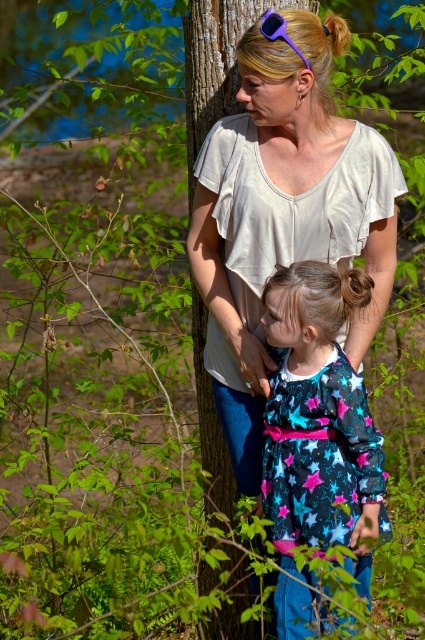
Is shiny star-patterned dress at center taller than smooth brown tree trunk at center?

No, shiny star-patterned dress at center is not taller than smooth brown tree trunk at center.

Does shiny star-patterned dress at center appear under smooth brown tree trunk at center?

No.

This screenshot has height=640, width=425. In order to click on shiny star-patterned dress at center in this screenshot , I will do pos(319,420).

Is smooth brown tree trunk at center smaller than purple plastic goggles at upper center?

Incorrect, smooth brown tree trunk at center is not smaller in size than purple plastic goggles at upper center.

Which of these two, smooth brown tree trunk at center or purple plastic goggles at upper center, stands taller?

With more height is smooth brown tree trunk at center.

Does point (200, 97) come closer to viewer compared to point (274, 20)?

No, (200, 97) is behind (274, 20).

Where is `smooth brown tree trunk at center`? This screenshot has height=640, width=425. smooth brown tree trunk at center is located at coordinates (212, 67).

Which is more to the left, shiny star-patterned dress at center or purple plastic goggles at upper center?

From the viewer's perspective, purple plastic goggles at upper center appears more on the left side.

What do you see at coordinates (319, 420) in the screenshot? The image size is (425, 640). I see `shiny star-patterned dress at center` at bounding box center [319, 420].

What are the coordinates of `shiny star-patterned dress at center` in the screenshot? It's located at (319, 420).